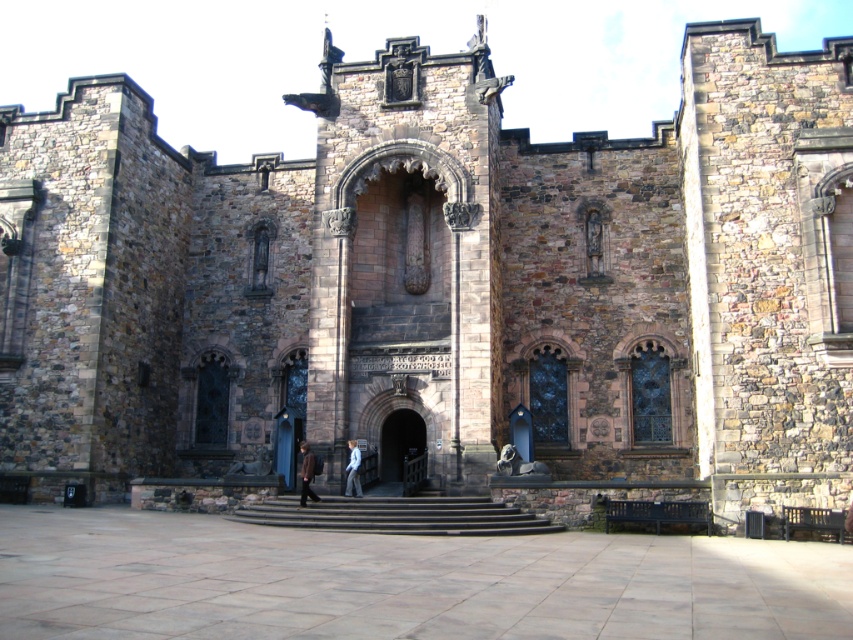
In the scene shown: You are standing at the entrance of Edinburgh Castle and want to take a photo of a specific point marked at coordinates point (x=390, y=442). If your camera has a maximum focus range of 200 feet, will it be able to focus on that point?

The distance of point (x=390, y=442) from the camera is 188.96 feet, which is within the camera maximum focus range of 200 feet. Therefore, the camera can focus on that point.

You are visiting Edinburgh Castle and notice a light blue denim jacket at center and black stone stairs at center. Which object is positioned to the right of the other?

The black stone stairs at center is to the right of light blue denim jacket at center.